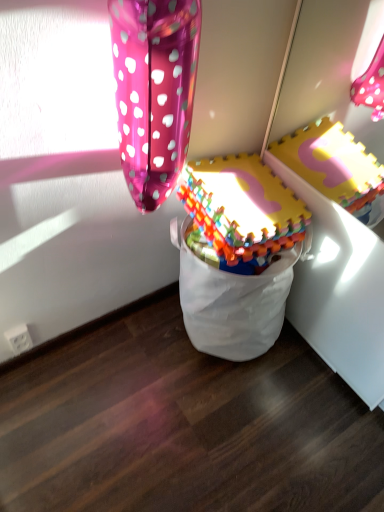
Question: Is multicolored plastic blocks at center to the left or to the right of glossy metallic balloon at upper left in the image?

Choices:
 (A) right
 (B) left

Answer: (A)

Question: In terms of height, does multicolored plastic blocks at center look taller or shorter compared to glossy metallic balloon at upper left?

Choices:
 (A) short
 (B) tall

Answer: (A)

Question: From the image's perspective, relative to glossy metallic balloon at upper left, is multicolored plastic blocks at center above or below?

Choices:
 (A) above
 (B) below

Answer: (B)

Question: Relative to multicolored plastic blocks at center, is glossy metallic balloon at upper left in front or behind?

Choices:
 (A) behind
 (B) front

Answer: (B)

Question: Looking at their shapes, would you say glossy metallic balloon at upper left is wider or thinner than multicolored plastic blocks at center?

Choices:
 (A) wide
 (B) thin

Answer: (B)

Question: Is glossy metallic balloon at upper left situated inside multicolored plastic blocks at center or outside?

Choices:
 (A) inside
 (B) outside

Answer: (B)

Question: Is glossy metallic balloon at upper left taller or shorter than multicolored plastic blocks at center?

Choices:
 (A) short
 (B) tall

Answer: (B)